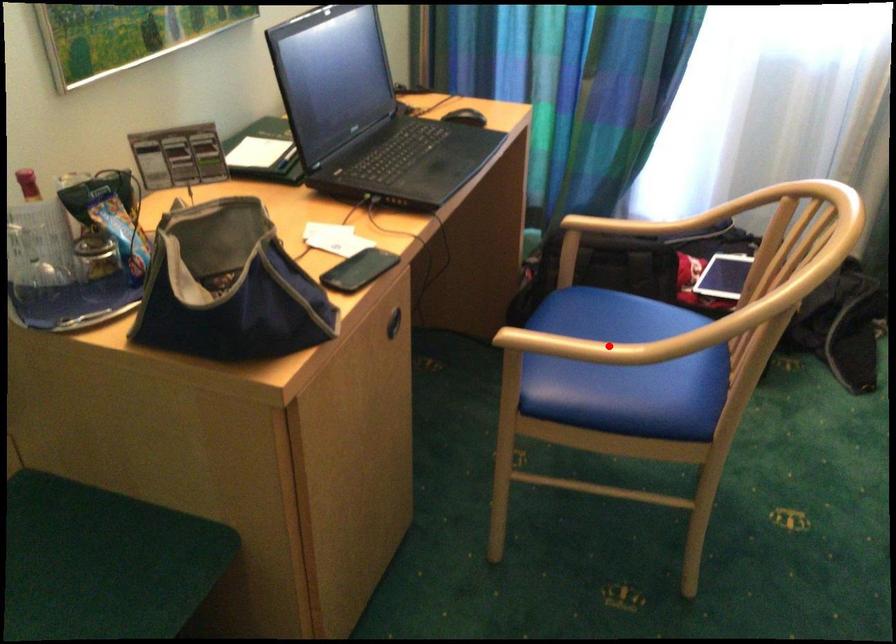
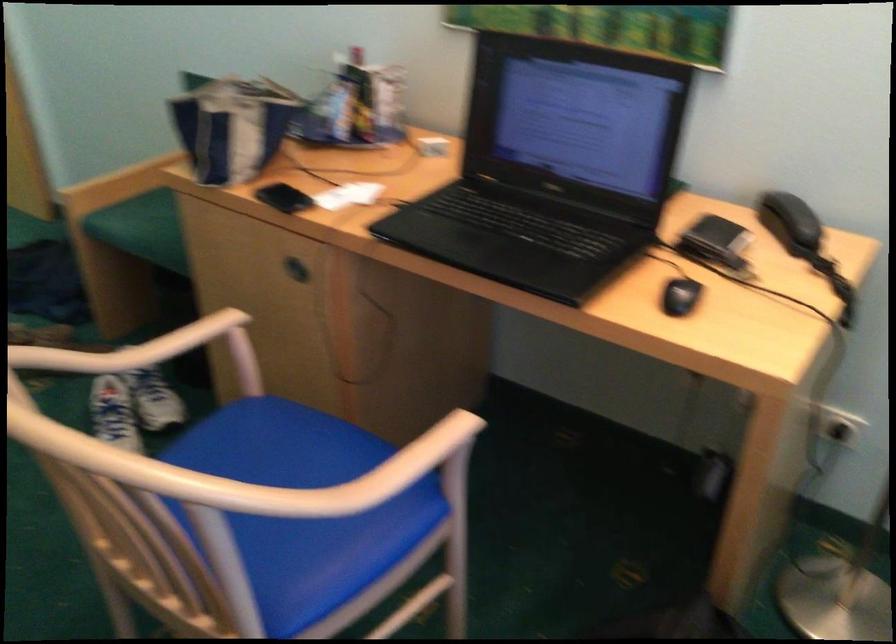
Find the pixel in the second image that matches the highlighted location in the first image.

(167, 365)